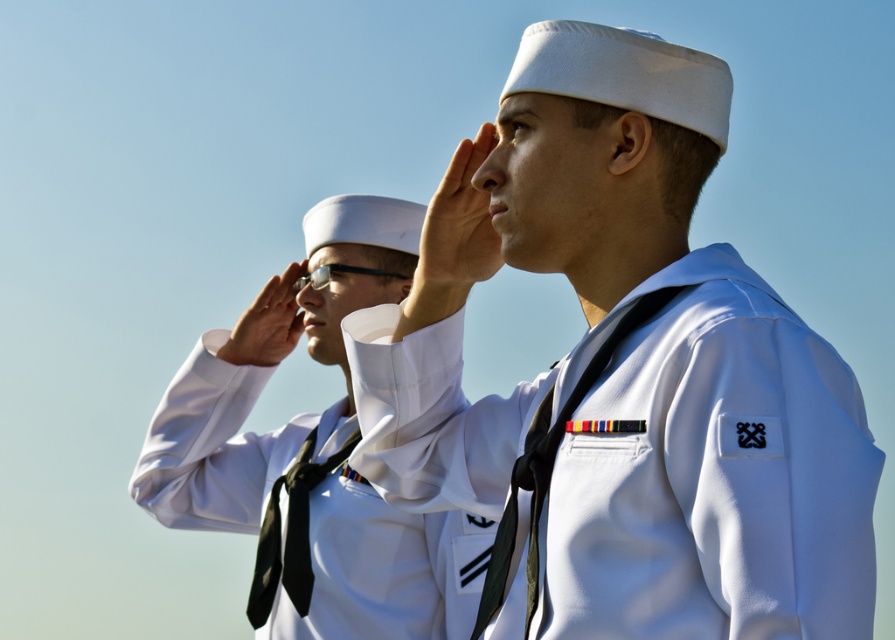
Question: Is white matte uniform at center closer to the viewer compared to white matte sailor uniform at center?

Choices:
 (A) no
 (B) yes

Answer: (B)

Question: Where is white matte uniform at center located in relation to white matte sailor uniform at center in the image?

Choices:
 (A) right
 (B) left

Answer: (A)

Question: Can you confirm if white matte uniform at center is thinner than white matte sailor uniform at center?

Choices:
 (A) yes
 (B) no

Answer: (A)

Question: Which point is closer to the camera?

Choices:
 (A) white matte sailor uniform at center
 (B) white matte uniform at center

Answer: (B)

Question: Which object appears farthest from the camera in this image?

Choices:
 (A) white matte sailor uniform at center
 (B) white matte uniform at center

Answer: (A)